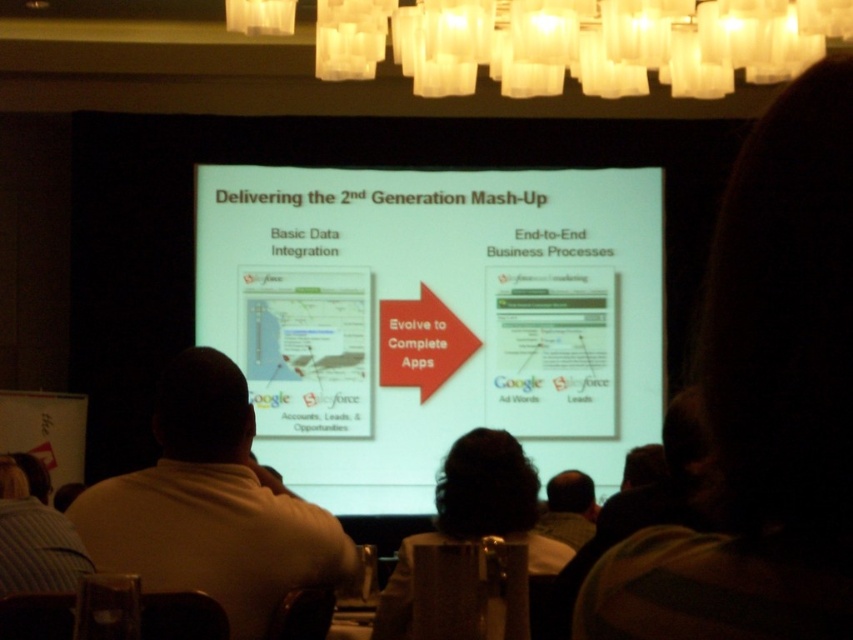
Question: Does white matte projector screen at center have a greater width compared to white shirt at center?

Choices:
 (A) yes
 (B) no

Answer: (A)

Question: Among these points, which one is nearest to the camera?

Choices:
 (A) (305, 509)
 (B) (593, 72)

Answer: (A)

Question: Does translucent glass chandelier at upper center have a lesser width compared to white shirt at center?

Choices:
 (A) yes
 (B) no

Answer: (B)

Question: Does translucent glass chandelier at upper center have a smaller size compared to white shirt at center?

Choices:
 (A) no
 (B) yes

Answer: (A)

Question: Among these objects, which one is farthest from the camera?

Choices:
 (A) white matte projector screen at center
 (B) translucent glass chandelier at upper center

Answer: (A)

Question: Which object appears closest to the camera in this image?

Choices:
 (A) translucent glass chandelier at upper center
 (B) white shirt at center
 (C) white matte projector screen at center

Answer: (B)